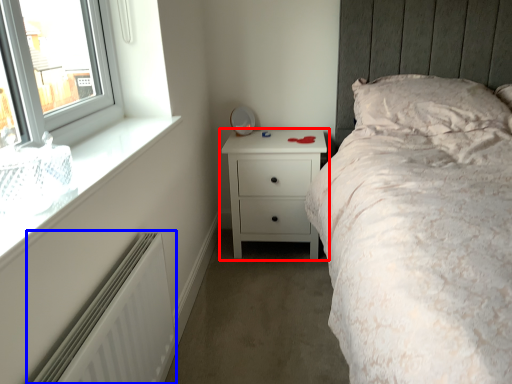
Question: Which point is further to the camera, chest of drawers (highlighted by a red box) or radiator (highlighted by a blue box)?

Choices:
 (A) chest of drawers
 (B) radiator

Answer: (A)